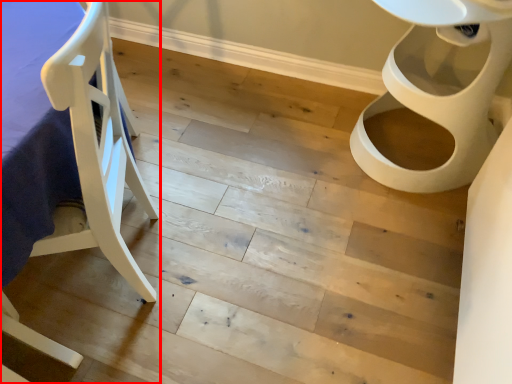
Question: From the image's perspective, considering the relative positions of furniture (annotated by the red box) and toilet in the image provided, where is furniture (annotated by the red box) located with respect to the staircase?

Choices:
 (A) below
 (B) above

Answer: (A)